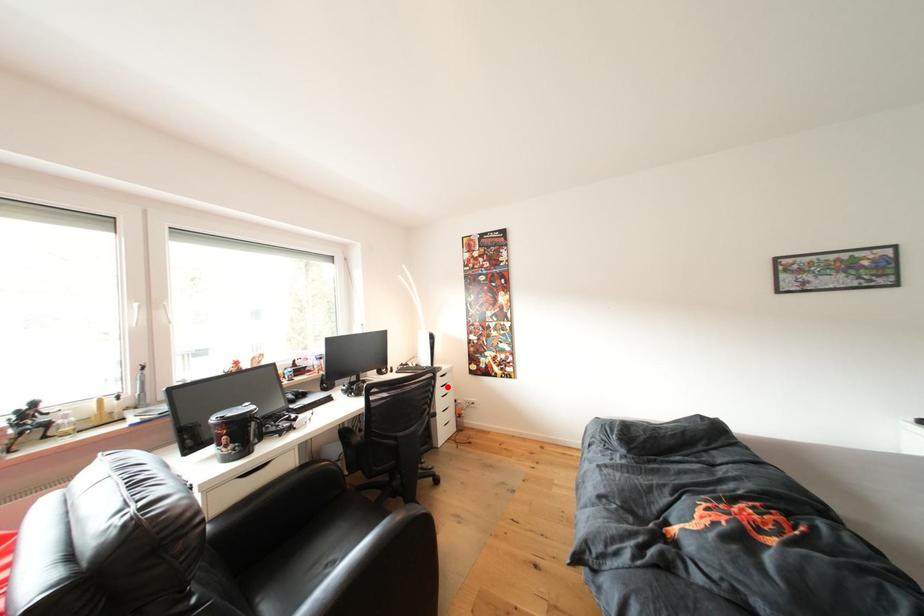
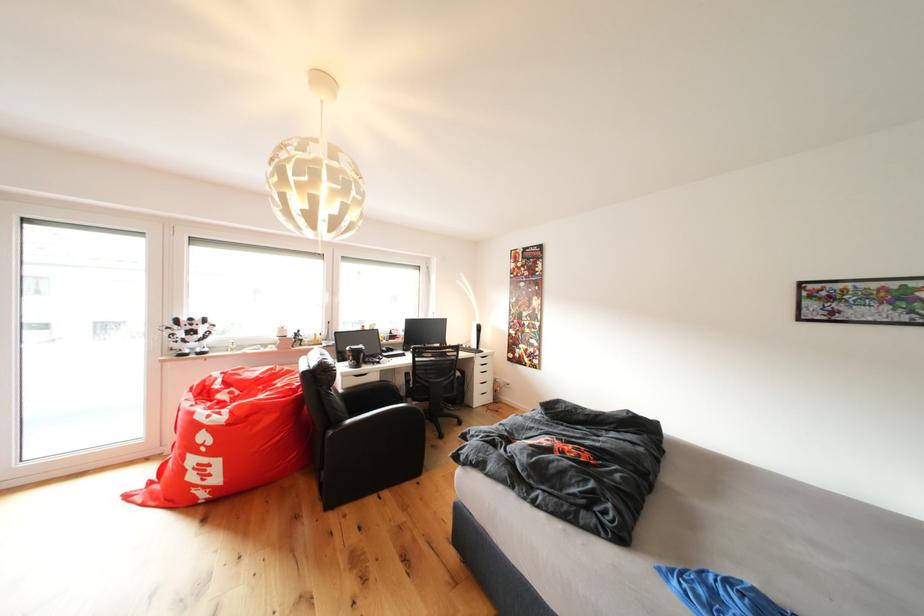
In the second image, find the point that corresponds to the highlighted location in the first image.

(487, 366)